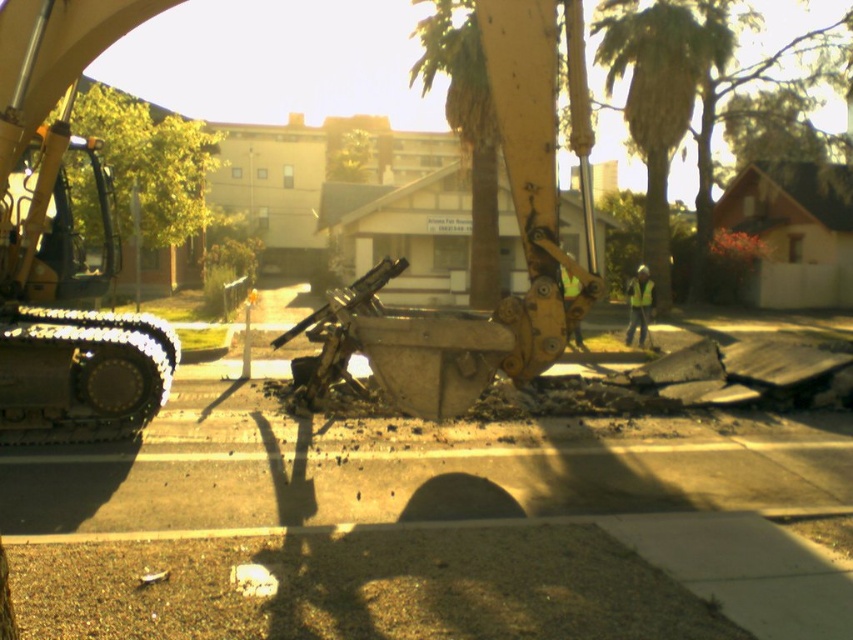
Does yellow metallic excavator at left have a larger size compared to green leafy palm tree at upper center?

Incorrect, yellow metallic excavator at left is not larger than green leafy palm tree at upper center.

In the scene shown: Who is higher up, yellow metallic excavator at left or green leafy palm tree at upper center?

green leafy palm tree at upper center is above.

The height and width of the screenshot is (640, 853). I want to click on yellow metallic excavator at left, so 65,244.

Does point (65, 61) come in front of point (415, 337)?

That is True.

At what (x,y) coordinates should I click in order to perform the action: click on yellow metallic excavator at left. Please return your answer as a coordinate pair (x, y). The height and width of the screenshot is (640, 853). Looking at the image, I should click on [65, 244].

Find the location of `yellow metallic excavator at left`. yellow metallic excavator at left is located at coordinates (65, 244).

Can you confirm if green leafy palm tree at upper center is taller than yellow reflective vest at center?

Yes.

The height and width of the screenshot is (640, 853). What do you see at coordinates (657, 93) in the screenshot?
I see `green leafy palm tree at upper center` at bounding box center [657, 93].

Which is in front, point (610, 26) or point (647, 298)?

Point (647, 298) is in front.

The height and width of the screenshot is (640, 853). In order to click on green leafy palm tree at upper center in this screenshot , I will do `click(657, 93)`.